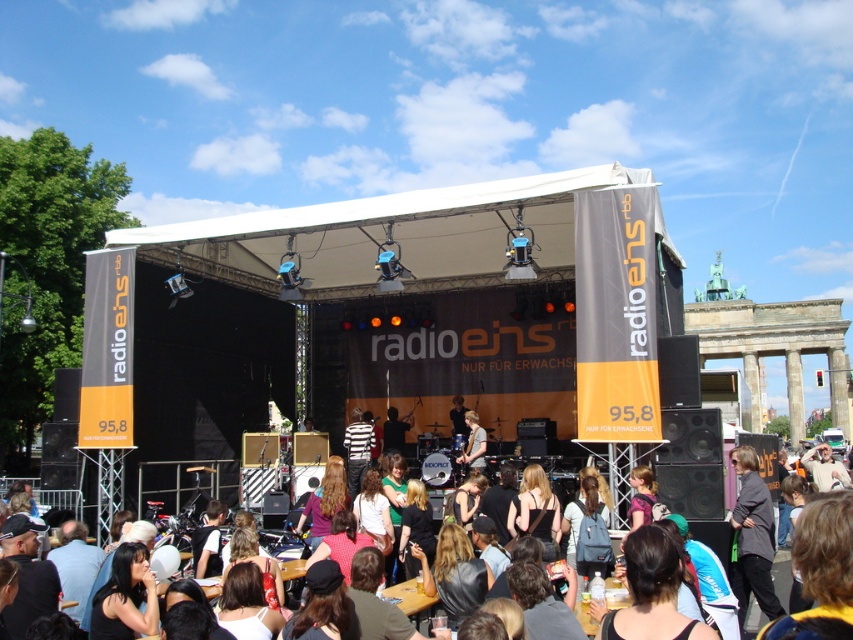
You are a photographer at the concert and need to capture both the dark gray fabric jacket at lower right and the matte black jacket at center in a single shot. Which jacket should you focus on first to ensure both are in frame?

The dark gray fabric jacket at lower right is smaller in size compared to the matte black jacket at center, so you should focus on the matte black jacket at center first to ensure both fit within the frame.

You are standing at the concert venue and want to take a photo of both the stage and the two points marked in the image. The first point is at coordinates point (752, 560) and the second point is at point (476, 468). To ensure both points are visible in your photo, which point should you position closer to the front of the stage?

Point (476, 468) should be positioned closer to the front of the stage because point (752, 560) is in front of point (476, 468), so positioning the latter closer to the front will keep both points in frame.